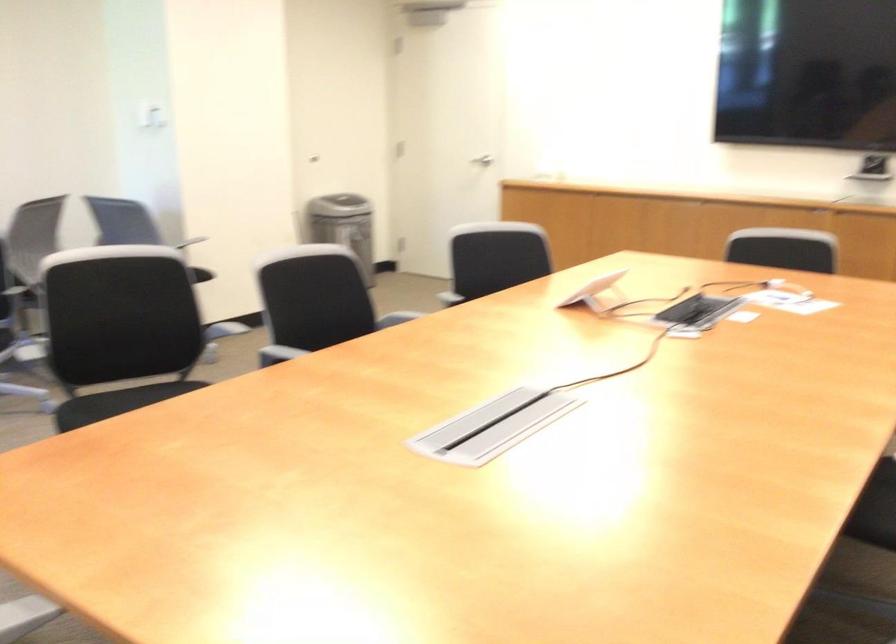
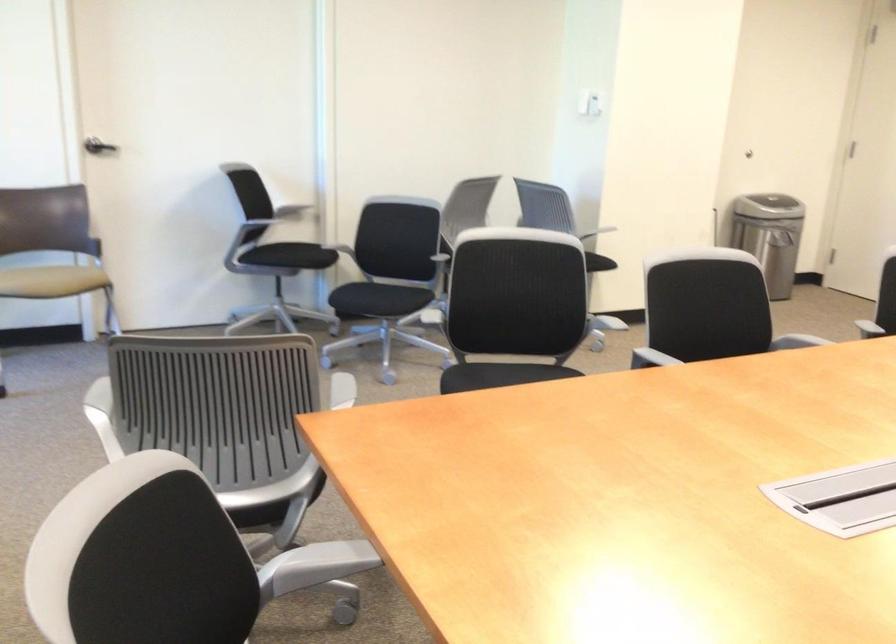
The point at [276,355] is marked in the first image. Where is the corresponding point in the second image?

(650, 359)